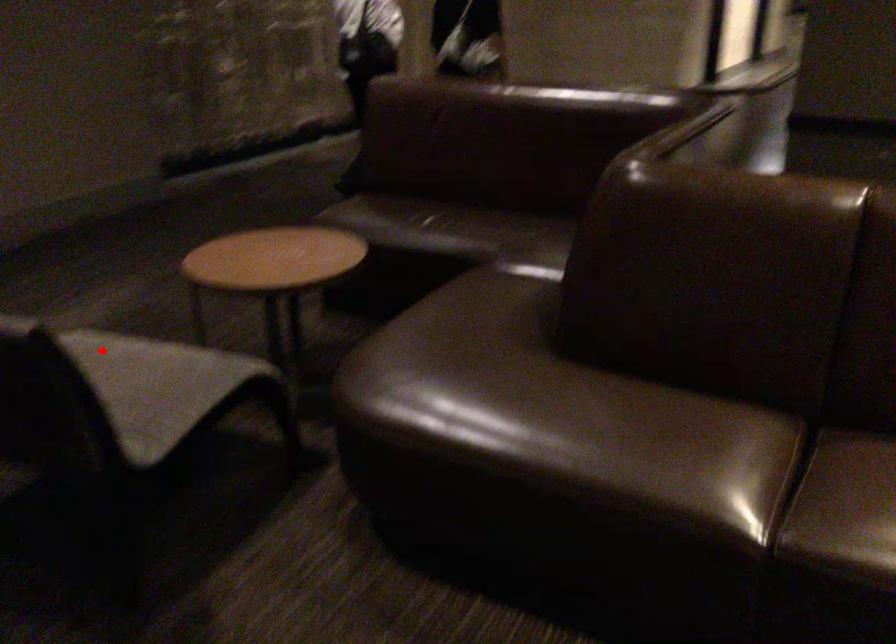
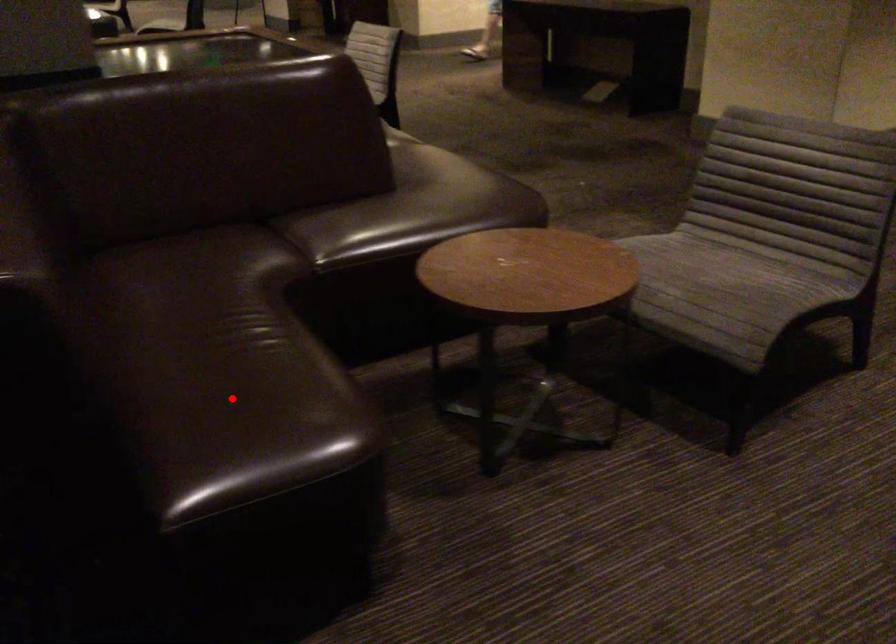
I am providing you with two images of the same scene from different viewpoints. A red point is marked on the first image and another point is marked on the second image. Is the marked point in image1 the same physical position as the marked point in image2?

No